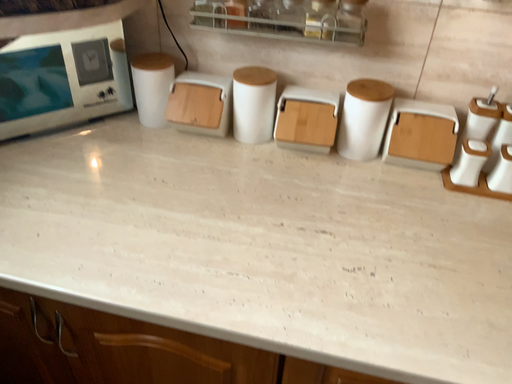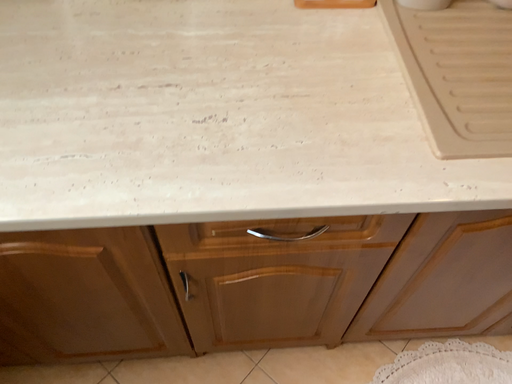
Question: Which way did the camera rotate in the video?

Choices:
 (A) rotated upward
 (B) rotated downward

Answer: (B)